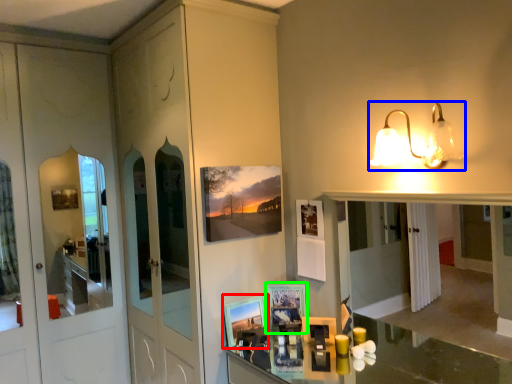
Question: Which object is the farthest from picture frame (highlighted by a red box)? Choose among these: light fixture (highlighted by a blue box) or picture frame (highlighted by a green box).

Choices:
 (A) light fixture
 (B) picture frame

Answer: (A)